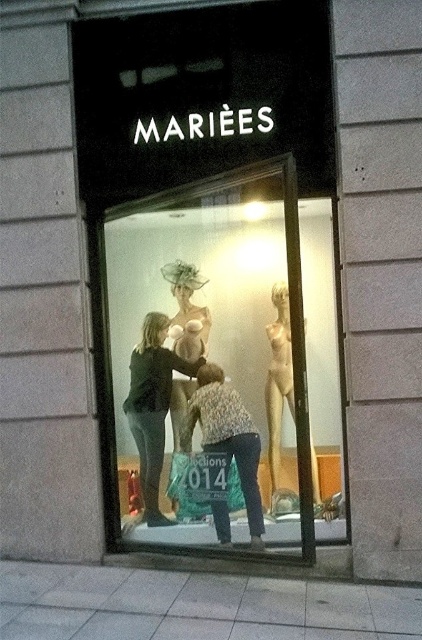
The width and height of the screenshot is (422, 640). Describe the element at coordinates (222, 368) in the screenshot. I see `transparent glass mannequin at center` at that location.

Does point (338, 348) come behind point (156, 394)?

Yes, it is.

This screenshot has height=640, width=422. I want to click on transparent glass mannequin at center, so click(222, 368).

The width and height of the screenshot is (422, 640). What are the coordinates of `transparent glass mannequin at center` in the screenshot? It's located at (222, 368).

Measure the distance between transparent glass mannequin at center and patterned fabric blouse at center.

A distance of 18.55 inches exists between transparent glass mannequin at center and patterned fabric blouse at center.

Is transparent glass mannequin at center behind patterned fabric blouse at center?

No, transparent glass mannequin at center is closer to the viewer.

I want to click on transparent glass mannequin at center, so click(x=222, y=368).

Identify the location of transparent glass mannequin at center. The height and width of the screenshot is (640, 422). (222, 368).

Which is more to the left, dark green fabric dress at center or patterned fabric blouse at center?

dark green fabric dress at center

Is dark green fabric dress at center bigger than patterned fabric blouse at center?

Indeed, dark green fabric dress at center has a larger size compared to patterned fabric blouse at center.

The width and height of the screenshot is (422, 640). What are the coordinates of `dark green fabric dress at center` in the screenshot? It's located at (153, 406).

I want to click on dark green fabric dress at center, so click(x=153, y=406).